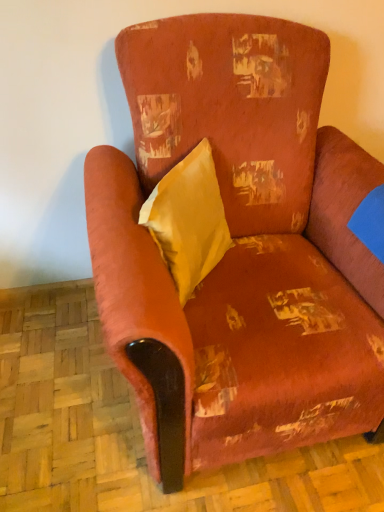
Where is `distressed velvet armchair at center`? The width and height of the screenshot is (384, 512). distressed velvet armchair at center is located at coordinates (x=236, y=246).

This screenshot has height=512, width=384. What do you see at coordinates (236, 246) in the screenshot? I see `distressed velvet armchair at center` at bounding box center [236, 246].

Describe the element at coordinates (188, 220) in the screenshot. I see `yellow fabric pillow at center` at that location.

The width and height of the screenshot is (384, 512). Find the location of `yellow fabric pillow at center`. yellow fabric pillow at center is located at coordinates (188, 220).

Locate an element on the screen. This screenshot has height=512, width=384. distressed velvet armchair at center is located at coordinates (236, 246).

Which object is positioned more to the right, yellow fabric pillow at center or distressed velvet armchair at center?

distressed velvet armchair at center is more to the right.

Consider the image. Considering the relative positions of yellow fabric pillow at center and distressed velvet armchair at center in the image provided, is yellow fabric pillow at center in front of distressed velvet armchair at center?

No, the depth of yellow fabric pillow at center is greater than that of distressed velvet armchair at center.

Is point (182, 160) farther from camera compared to point (245, 392)?

Yes.

From the image's perspective, would you say yellow fabric pillow at center is shown under distressed velvet armchair at center?

Actually, yellow fabric pillow at center appears above distressed velvet armchair at center in the image.

From a real-world perspective, which object stands above the other?

yellow fabric pillow at center, from a real-world perspective.

Considering the relative sizes of yellow fabric pillow at center and distressed velvet armchair at center in the image provided, is yellow fabric pillow at center thinner than distressed velvet armchair at center?

Yes, yellow fabric pillow at center is thinner than distressed velvet armchair at center.

From the picture: Who is shorter, yellow fabric pillow at center or distressed velvet armchair at center?

yellow fabric pillow at center is shorter.

Between yellow fabric pillow at center and distressed velvet armchair at center, which one has smaller size?

With smaller size is yellow fabric pillow at center.

Does yellow fabric pillow at center contain distressed velvet armchair at center?

That's incorrect, distressed velvet armchair at center is not inside yellow fabric pillow at center.

Would you consider yellow fabric pillow at center to be distant from distressed velvet armchair at center?

Actually, yellow fabric pillow at center and distressed velvet armchair at center are a little close together.

Is yellow fabric pillow at center looking in the opposite direction of distressed velvet armchair at center?

Yes, distressed velvet armchair at center is at the back of yellow fabric pillow at center.

The width and height of the screenshot is (384, 512). There is a distressed velvet armchair at center. Identify the location of throw pillow above it (from a real-world perspective). (188, 220).

In the image, is distressed velvet armchair at center on the left side or the right side of yellow fabric pillow at center?

In the image, distressed velvet armchair at center appears on the right side of yellow fabric pillow at center.

Does distressed velvet armchair at center lie behind yellow fabric pillow at center?

No, distressed velvet armchair at center is closer to the viewer.

Which point is more distant from viewer, (345, 374) or (187, 282)?

The point (187, 282) is farther from the camera.

From the image's perspective, which one is positioned higher, distressed velvet armchair at center or yellow fabric pillow at center?

From the image's view, yellow fabric pillow at center is above.

From a real-world perspective, does distressed velvet armchair at center sit lower than yellow fabric pillow at center?

Yes.

Considering the sizes of objects distressed velvet armchair at center and yellow fabric pillow at center in the image provided, who is wider, distressed velvet armchair at center or yellow fabric pillow at center?

Wider between the two is distressed velvet armchair at center.

Considering the relative sizes of distressed velvet armchair at center and yellow fabric pillow at center in the image provided, is distressed velvet armchair at center taller than yellow fabric pillow at center?

Yes.

Who is bigger, distressed velvet armchair at center or yellow fabric pillow at center?

distressed velvet armchair at center.

Is yellow fabric pillow at center inside distressed velvet armchair at center?

Indeed, yellow fabric pillow at center is located within distressed velvet armchair at center.

Is distressed velvet armchair at center not close to yellow fabric pillow at center?

No.

Consider the image. Is yellow fabric pillow at center at the back of distressed velvet armchair at center?

Yes, distressed velvet armchair at center is positioned with its back facing yellow fabric pillow at center.

Can you tell me how much distressed velvet armchair at center and yellow fabric pillow at center differ in facing direction?

49.3 degrees.

Where is `throw pillow above the distressed velvet armchair at center (from a real-world perspective)`? Image resolution: width=384 pixels, height=512 pixels. throw pillow above the distressed velvet armchair at center (from a real-world perspective) is located at coordinates click(x=188, y=220).

Locate an element on the screen. The width and height of the screenshot is (384, 512). chair located in front of the yellow fabric pillow at center is located at coordinates (236, 246).

Locate an element on the screen. This screenshot has width=384, height=512. throw pillow that appears above the distressed velvet armchair at center (from a real-world perspective) is located at coordinates (188, 220).